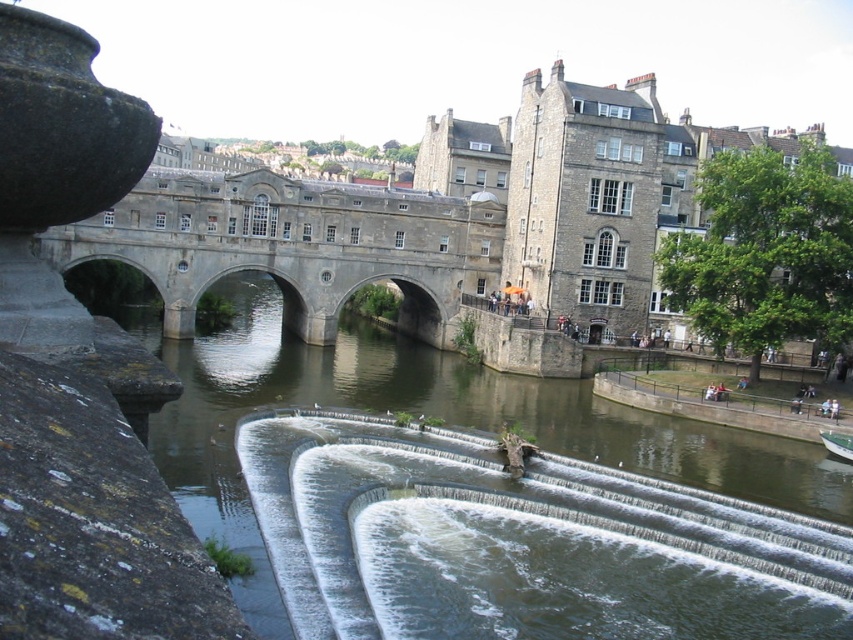
Question: Which point is closer to the camera?

Choices:
 (A) (749, 442)
 (B) (837, 449)
 (C) (432, 280)

Answer: (B)

Question: Among these objects, which one is farthest from the camera?

Choices:
 (A) stone bridge at center
 (B) greenish-brown stone river at center
 (C) green plastic boat at lower right

Answer: (C)

Question: Is greenish-brown stone river at center below stone bridge at center?

Choices:
 (A) yes
 (B) no

Answer: (A)

Question: Does greenish-brown stone river at center appear on the left side of green plastic boat at lower right?

Choices:
 (A) yes
 (B) no

Answer: (A)

Question: Is greenish-brown stone river at center below green plastic boat at lower right?

Choices:
 (A) yes
 (B) no

Answer: (B)

Question: Among these objects, which one is farthest from the camera?

Choices:
 (A) stone bridge at center
 (B) greenish-brown stone river at center
 (C) green plastic boat at lower right

Answer: (C)